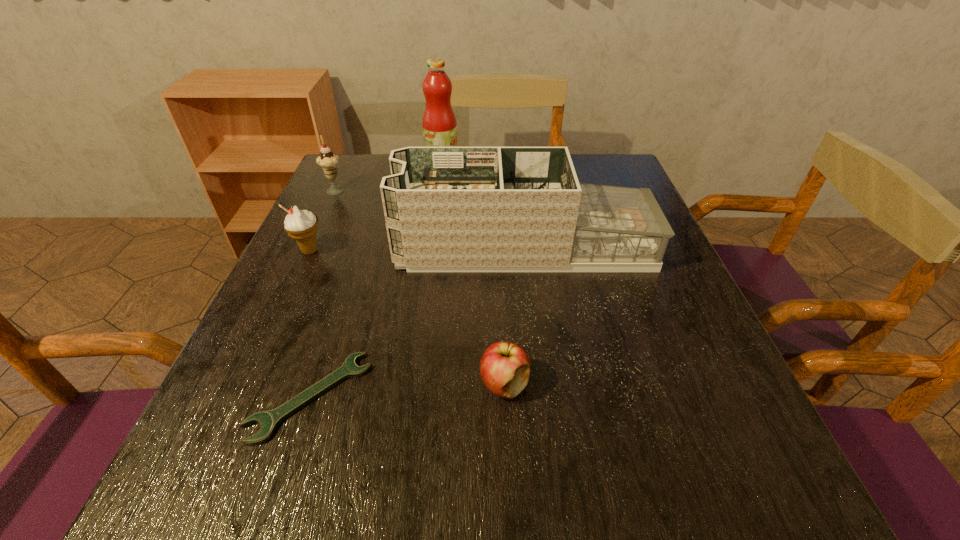
At what (x,y) coordinates should I click in order to perform the action: click on free space between the second tallest object and the apple. Please return your answer as a coordinate pair (x, y). Looking at the image, I should click on (515, 315).

Identify the location of free point between the wrench and the fruit juice. (376, 282).

The image size is (960, 540). Identify the location of empty space that is in between the fourth shortest object and the shortest object. (324, 293).

In order to click on free space between the farthest object and the nearer icecream in this screenshot , I will do `click(376, 209)`.

Where is `free area in between the dollhouse and the fifth tallest object`? This screenshot has height=540, width=960. free area in between the dollhouse and the fifth tallest object is located at coordinates (515, 315).

The image size is (960, 540). In order to click on object that is the closest to the fifth nearest object in this screenshot , I will do click(301, 225).

Locate an element on the screen. The image size is (960, 540). object that is the third closest one to the fifth shortest object is located at coordinates (269, 420).

You are a GUI agent. You are given a task and a screenshot of the screen. Output one action in this format:
    pyautogui.click(x=<x>, y=<y>)
    Task: Click on the blank area in the image that satisfies the following two spatial constraints: 1. at the entrance of the dollhouse; 2. on the front side of the wrench
    Image resolution: width=960 pixels, height=540 pixels.
    Given the screenshot: What is the action you would take?
    pyautogui.click(x=542, y=396)

I want to click on vacant space that satisfies the following two spatial constraints: 1. on the front label of the fifth tallest object; 2. on the right side of the fruit juice, so click(x=414, y=384).

Image resolution: width=960 pixels, height=540 pixels. I want to click on vacant region that satisfies the following two spatial constraints: 1. on the front label of the apple; 2. on the left side of the tallest object, so click(x=414, y=384).